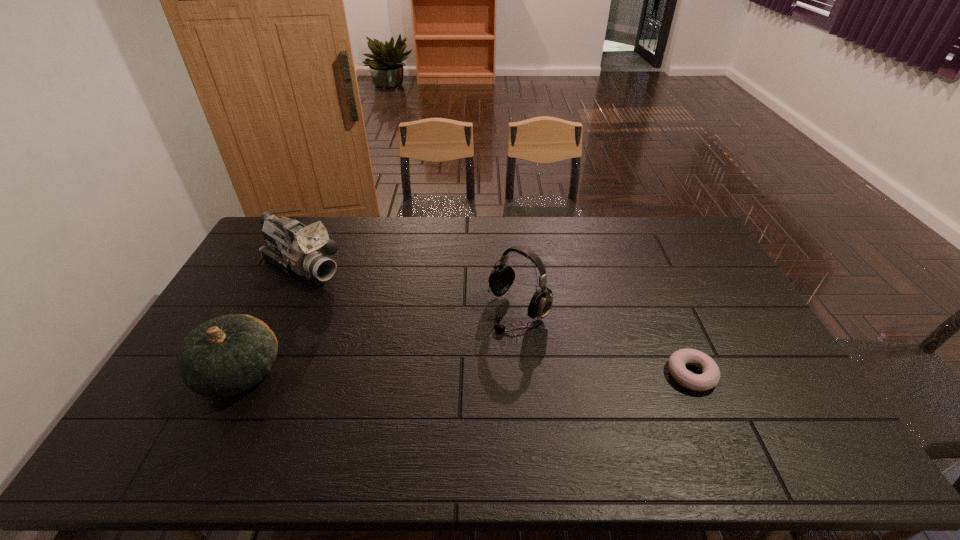
The height and width of the screenshot is (540, 960). Identify the location of vacant point located 0.300m with the microphone on the side of the headset. (424, 388).

Identify the location of vacant space situated with the microphone on the side of the headset. (435, 379).

The height and width of the screenshot is (540, 960). I want to click on free space located 0.120m with the microphone on the side of the headset, so click(470, 350).

Locate an element on the screen. The height and width of the screenshot is (540, 960). object that is at the far edge is located at coordinates (293, 247).

The width and height of the screenshot is (960, 540). Identify the location of gourd present at the near edge. (225, 356).

Locate an element on the screen. The image size is (960, 540). doughnut situated at the near edge is located at coordinates (710, 376).

In order to click on gourd that is positioned at the left edge in this screenshot , I will do `click(225, 356)`.

Where is `camcorder present at the left edge`? Image resolution: width=960 pixels, height=540 pixels. camcorder present at the left edge is located at coordinates (293, 247).

Where is `object that is at the far left corner`? The width and height of the screenshot is (960, 540). object that is at the far left corner is located at coordinates (293, 247).

Locate an element on the screen. object present at the near left corner is located at coordinates (225, 356).